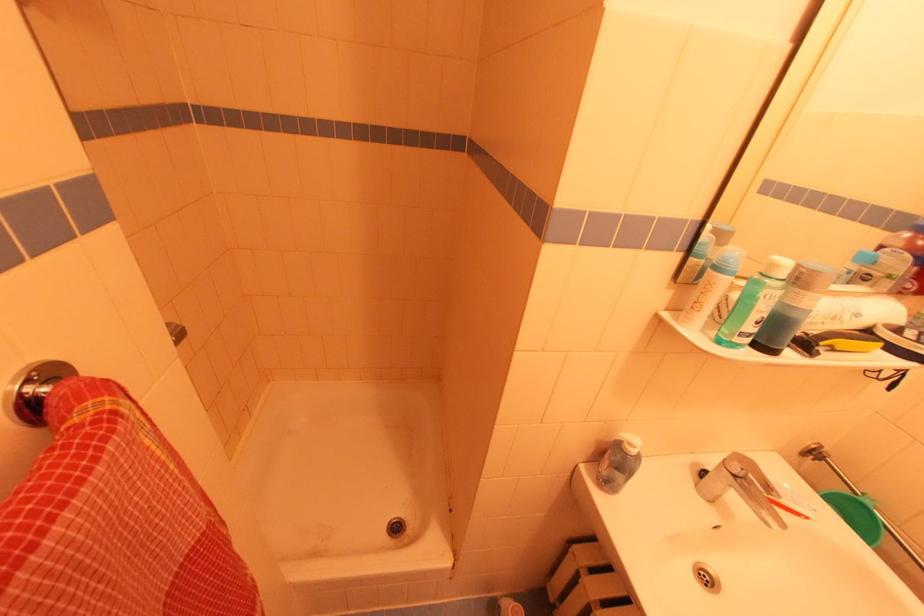
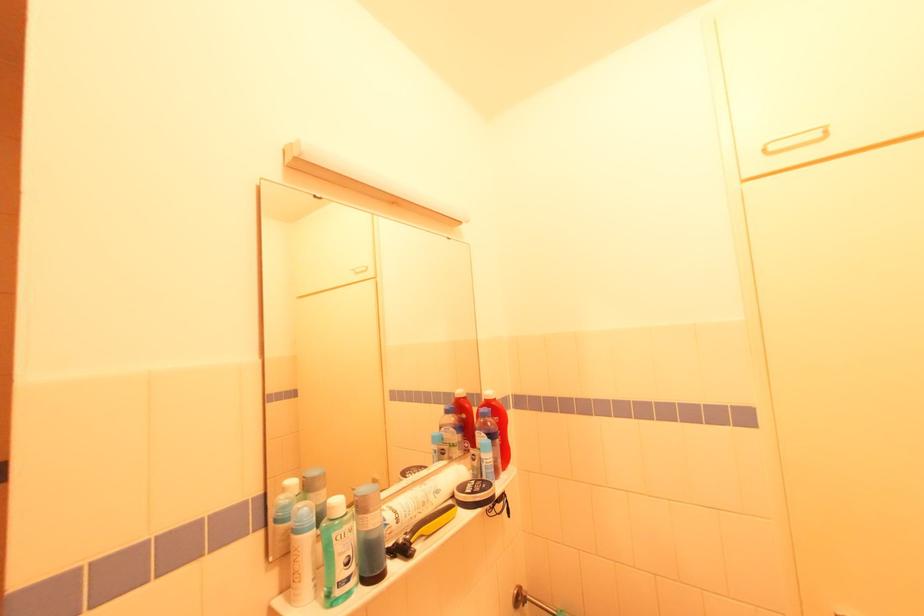
The point at (x=807, y=347) is marked in the first image. Where is the corresponding point in the second image?

(406, 552)